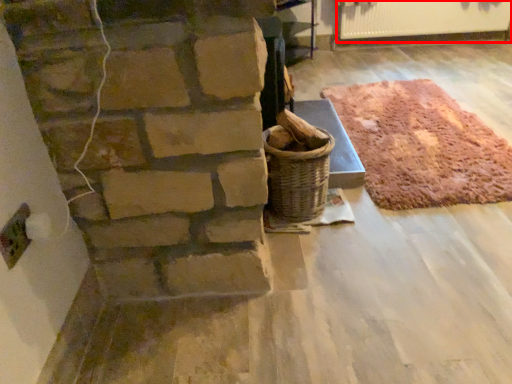
Question: Considering the relative positions of radiator (annotated by the red box) and mat in the image provided, where is radiator (annotated by the red box) located with respect to the staircase?

Choices:
 (A) left
 (B) right

Answer: (B)